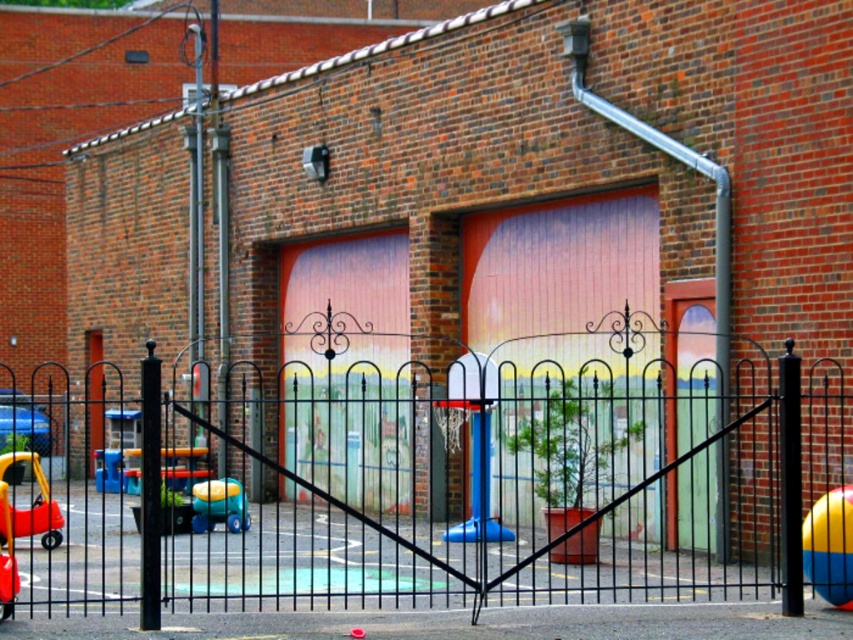
Can you confirm if matte yellow plastic car at lower left is positioned below matte plastic toy car at lower left?

Incorrect, matte yellow plastic car at lower left is not positioned below matte plastic toy car at lower left.

Consider the image. Can you confirm if matte yellow plastic car at lower left is shorter than matte plastic toy car at lower left?

Incorrect, matte yellow plastic car at lower left's height does not fall short of matte plastic toy car at lower left's.

Between point (39, 483) and point (213, 499), which one is positioned in front?

Point (39, 483) is more forward.

Identify the location of matte yellow plastic car at lower left. (32, 506).

Does yellow rubber beach ball at right have a greater height compared to matte yellow plastic car at lower left?

In fact, yellow rubber beach ball at right may be shorter than matte yellow plastic car at lower left.

Between yellow rubber beach ball at right and matte yellow plastic car at lower left, which one is positioned higher?

yellow rubber beach ball at right is above.

Is point (822, 545) closer to viewer compared to point (9, 508)?

Yes.

Identify the location of yellow rubber beach ball at right. The image size is (853, 640). (828, 547).

Does pink painted wood garage door at center appear on the right side of matte yellow plastic car at lower left?

Indeed, pink painted wood garage door at center is positioned on the right side of matte yellow plastic car at lower left.

Where is `pink painted wood garage door at center`? The height and width of the screenshot is (640, 853). pink painted wood garage door at center is located at coordinates (560, 280).

Where is `pink painted wood garage door at center`? The height and width of the screenshot is (640, 853). pink painted wood garage door at center is located at coordinates (560, 280).